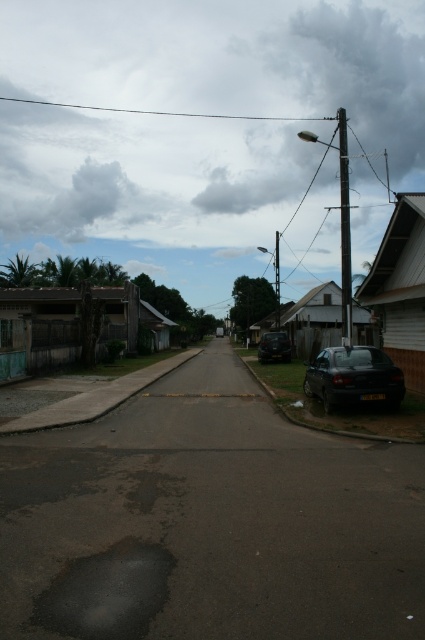
Question: Which is nearer to the shiny black car at lower right?

Choices:
 (A) black wire at upper center
 (B) shiny black car at center

Answer: (B)

Question: Estimate the real-world distances between objects in this image. Which object is farther from the black wire at upper center?

Choices:
 (A) shiny black car at center
 (B) shiny black car at lower right

Answer: (B)

Question: Does shiny black car at lower right have a smaller size compared to black wire at upper center?

Choices:
 (A) yes
 (B) no

Answer: (A)

Question: Can you confirm if shiny black car at lower right is thinner than black wire at upper center?

Choices:
 (A) yes
 (B) no

Answer: (A)

Question: Considering the relative positions of black wire at upper center and shiny black car at center in the image provided, where is black wire at upper center located with respect to shiny black car at center?

Choices:
 (A) left
 (B) right

Answer: (A)

Question: Which of these objects is positioned farthest from the black wire at upper center?

Choices:
 (A) shiny black car at center
 (B) shiny black car at lower right

Answer: (B)